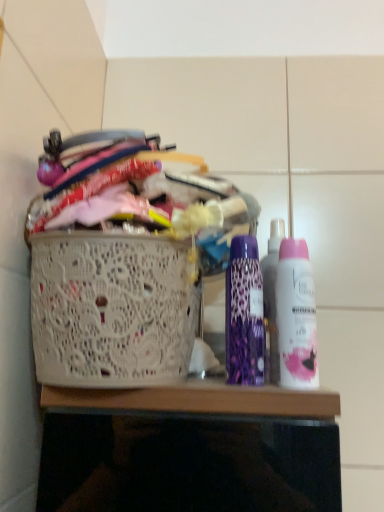
Question: From the image's perspective, is pink matte deodorant at right, the 2th bottle in the left-to-right sequence, on white lace basket at left?

Choices:
 (A) no
 (B) yes

Answer: (B)

Question: Is pink matte deodorant at right, which appears as the first bottle when viewed from the right, at the right side of white lace basket at left?

Choices:
 (A) no
 (B) yes

Answer: (B)

Question: Considering the relative positions of pink matte deodorant at right, which appears as the first bottle when viewed from the right, and white lace basket at left in the image provided, is pink matte deodorant at right, which appears as the first bottle when viewed from the right, to the left of white lace basket at left from the viewer's perspective?

Choices:
 (A) no
 (B) yes

Answer: (A)

Question: Considering the relative positions of pink matte deodorant at right, the 2th bottle in the left-to-right sequence, and white lace basket at left in the image provided, is pink matte deodorant at right, the 2th bottle in the left-to-right sequence, in front of white lace basket at left?

Choices:
 (A) no
 (B) yes

Answer: (A)

Question: From the image's perspective, is pink matte deodorant at right, the 2th bottle in the left-to-right sequence, below white lace basket at left?

Choices:
 (A) no
 (B) yes

Answer: (A)

Question: From the image's perspective, is pink matte deodorant at right, the 2th bottle in the left-to-right sequence, above or below purple leopard print deodorant at center, the second bottle in the right-to-left sequence?

Choices:
 (A) below
 (B) above

Answer: (A)

Question: In the image, is pink matte deodorant at right, which appears as the first bottle when viewed from the right, positioned in front of or behind purple leopard print deodorant at center, positioned as the 1th bottle in left-to-right order?

Choices:
 (A) front
 (B) behind

Answer: (A)

Question: Is pink matte deodorant at right, which appears as the first bottle when viewed from the right, wider or thinner than purple leopard print deodorant at center, the second bottle in the right-to-left sequence?

Choices:
 (A) thin
 (B) wide

Answer: (B)

Question: Based on their sizes in the image, would you say pink matte deodorant at right, the 2th bottle in the left-to-right sequence, is bigger or smaller than purple leopard print deodorant at center, positioned as the 1th bottle in left-to-right order?

Choices:
 (A) big
 (B) small

Answer: (B)

Question: Visually, is white lace basket at left positioned to the left or to the right of purple leopard print deodorant at center, positioned as the 1th bottle in left-to-right order?

Choices:
 (A) right
 (B) left

Answer: (B)

Question: Is white lace basket at left situated inside purple leopard print deodorant at center, the second bottle in the right-to-left sequence, or outside?

Choices:
 (A) inside
 (B) outside

Answer: (B)

Question: Is white lace basket at left in front of or behind purple leopard print deodorant at center, the second bottle in the right-to-left sequence, in the image?

Choices:
 (A) behind
 (B) front

Answer: (B)

Question: Looking at the image, does white lace basket at left seem bigger or smaller compared to purple leopard print deodorant at center, the second bottle in the right-to-left sequence?

Choices:
 (A) small
 (B) big

Answer: (B)

Question: Looking at their shapes, would you say pink matte deodorant at right, which appears as the first bottle when viewed from the right, is wider or thinner than white lace basket at left?

Choices:
 (A) thin
 (B) wide

Answer: (A)

Question: In terms of height, does pink matte deodorant at right, the 2th bottle in the left-to-right sequence, look taller or shorter compared to white lace basket at left?

Choices:
 (A) tall
 (B) short

Answer: (B)